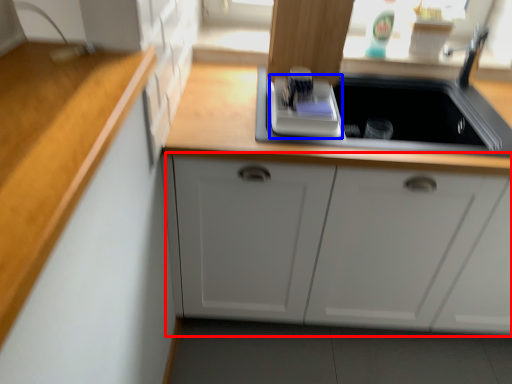
Question: Among these objects, which one is nearest to the camera, cabinetry (highlighted by a red box) or appliance (highlighted by a blue box)?

Choices:
 (A) cabinetry
 (B) appliance

Answer: (A)